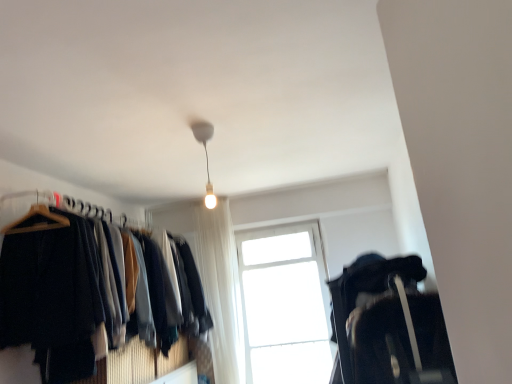
Question: Can transparent glass window at center be found inside black fabric suitcase at lower right, the 2th closet viewed from the left?

Choices:
 (A) yes
 (B) no

Answer: (B)

Question: Is black fabric suitcase at lower right, placed as the 1th closet when sorted from right to left, shorter than transparent glass window at center?

Choices:
 (A) no
 (B) yes

Answer: (B)

Question: Is black fabric suitcase at lower right, the 2th closet viewed from the left, further to camera compared to transparent glass window at center?

Choices:
 (A) yes
 (B) no

Answer: (B)

Question: Can you confirm if black fabric suitcase at lower right, placed as the 1th closet when sorted from right to left, is positioned to the right of transparent glass window at center?

Choices:
 (A) yes
 (B) no

Answer: (A)

Question: Considering the relative sizes of black fabric suitcase at lower right, placed as the 1th closet when sorted from right to left, and transparent glass window at center in the image provided, is black fabric suitcase at lower right, placed as the 1th closet when sorted from right to left, taller than transparent glass window at center?

Choices:
 (A) yes
 (B) no

Answer: (B)

Question: Considering the relative positions of matte white bulb at upper center and black fabric suitcase at lower right, placed as the 1th closet when sorted from right to left, in the image provided, is matte white bulb at upper center to the left or to the right of black fabric suitcase at lower right, placed as the 1th closet when sorted from right to left,?

Choices:
 (A) right
 (B) left

Answer: (B)

Question: From a real-world perspective, relative to black fabric suitcase at lower right, the 2th closet viewed from the left, is matte white bulb at upper center vertically above or below?

Choices:
 (A) above
 (B) below

Answer: (A)

Question: Considering the positions of matte white bulb at upper center and black fabric suitcase at lower right, the 2th closet viewed from the left, in the image, is matte white bulb at upper center taller or shorter than black fabric suitcase at lower right, the 2th closet viewed from the left,?

Choices:
 (A) tall
 (B) short

Answer: (B)

Question: Is matte white bulb at upper center in front of or behind black fabric suitcase at lower right, the 2th closet viewed from the left, in the image?

Choices:
 (A) front
 (B) behind

Answer: (B)

Question: Is black fabric suitcase at lower right, placed as the 1th closet when sorted from right to left, wider or thinner than white sheer curtain at center?

Choices:
 (A) wide
 (B) thin

Answer: (A)

Question: In terms of height, does black fabric suitcase at lower right, the 2th closet viewed from the left, look taller or shorter compared to white sheer curtain at center?

Choices:
 (A) short
 (B) tall

Answer: (A)

Question: Considering their positions, is black fabric suitcase at lower right, placed as the 1th closet when sorted from right to left, located in front of or behind white sheer curtain at center?

Choices:
 (A) front
 (B) behind

Answer: (A)

Question: Choose the correct answer: Is black fabric suitcase at lower right, the 2th closet viewed from the left, inside white sheer curtain at center or outside it?

Choices:
 (A) inside
 (B) outside

Answer: (B)

Question: Is white sheer curtain at center to the left or to the right of matte black hangers at left, the 2th closet from the right, in the image?

Choices:
 (A) left
 (B) right

Answer: (B)

Question: From a real-world perspective, is white sheer curtain at center above or below matte black hangers at left, the 2th closet from the right?

Choices:
 (A) below
 (B) above

Answer: (A)